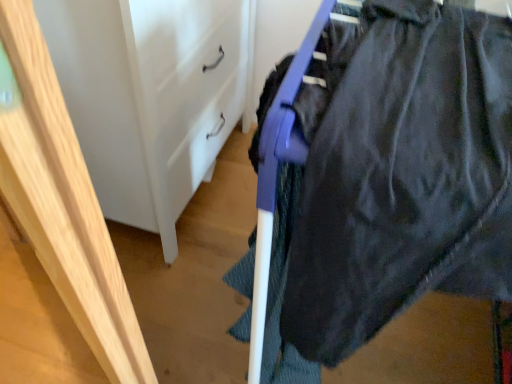
Measure the distance between point (79, 169) and camera.

Point (79, 169) is 11.50 inches from camera.

Locate an element on the screen. Image resolution: width=512 pixels, height=384 pixels. light wood frame at left is located at coordinates (63, 204).

Locate an element on the screen. The height and width of the screenshot is (384, 512). white matte/file cabinet at center is located at coordinates (149, 97).

Considering the relative sizes of white matte/file cabinet at center and dark matte fabric at upper right in the image provided, is white matte/file cabinet at center bigger than dark matte fabric at upper right?

No.

Would you say white matte/file cabinet at center is to the left or to the right of dark matte fabric at upper right in the picture?

white matte/file cabinet at center is positioned on dark matte fabric at upper right's left side.

Is white matte/file cabinet at center positioned with its back to dark matte fabric at upper right?

white matte/file cabinet at center is not turned away from dark matte fabric at upper right.

How different are the orientations of white matte/file cabinet at center and dark matte fabric at upper right in degrees?

They differ by 0.000244 degrees in their facing directions.

Looking at this image, can you confirm if white matte/file cabinet at center is taller than light wood frame at left?

No, white matte/file cabinet at center is not taller than light wood frame at left.

Is light wood frame at left a part of white matte/file cabinet at center?

Definitely not — light wood frame at left is not inside white matte/file cabinet at center.

Could you tell me if white matte/file cabinet at center is turned towards light wood frame at left?

No.

Is white matte/file cabinet at center wider than light wood frame at left?

Yes.

Considering their positions, is dark matte fabric at upper right located in front of or behind white matte/file cabinet at center?

dark matte fabric at upper right is positioned closer to the viewer than white matte/file cabinet at center.

Considering the relative sizes of dark matte fabric at upper right and white matte/file cabinet at center in the image provided, is dark matte fabric at upper right shorter than white matte/file cabinet at center?

Incorrect, the height of dark matte fabric at upper right does not fall short of that of white matte/file cabinet at center.

Visually, is dark matte fabric at upper right positioned to the left or to the right of white matte/file cabinet at center?

In the image, dark matte fabric at upper right appears on the right side of white matte/file cabinet at center.

Is dark matte fabric at upper right facing away from white matte/file cabinet at center?

Yes, dark matte fabric at upper right is facing away from white matte/file cabinet at center.

Can you tell me how much dark matte fabric at upper right and light wood frame at left differ in facing direction?

123 degrees separate the facing orientations of dark matte fabric at upper right and light wood frame at left.

From a real-world perspective, between dark matte fabric at upper right and light wood frame at left, who is vertically higher?

light wood frame at left.

Which of these two, dark matte fabric at upper right or light wood frame at left, is thinner?

light wood frame at left is thinner.

From the image's perspective, between dark matte fabric at upper right and light wood frame at left, which one is located above?

dark matte fabric at upper right is shown above in the image.

From the image's perspective, which is above, light wood frame at left or dark matte fabric at upper right?

dark matte fabric at upper right.

Is light wood frame at left taller or shorter than dark matte fabric at upper right?

light wood frame at left is taller than dark matte fabric at upper right.

Between light wood frame at left and dark matte fabric at upper right, which one has smaller size?

Smaller between the two is light wood frame at left.

Which is in front, light wood frame at left or white matte/file cabinet at center?

light wood frame at left is more forward.

Looking at this image, from the image's perspective, does light wood frame at left appear higher than white matte/file cabinet at center?

Incorrect, from the image's perspective, light wood frame at left is lower than white matte/file cabinet at center.

Which of these two, light wood frame at left or white matte/file cabinet at center, is wider?

Wider between the two is white matte/file cabinet at center.

Is light wood frame at left facing towards white matte/file cabinet at center?

No.

Where is `file cabinet on the left side of dark matte fabric at upper right`? file cabinet on the left side of dark matte fabric at upper right is located at coordinates (149, 97).

Find the location of a particular element. The height and width of the screenshot is (384, 512). file cabinet to the right of light wood frame at left is located at coordinates (x=149, y=97).

Based on their spatial positions, is white matte/file cabinet at center or light wood frame at left further from dark matte fabric at upper right?

Based on the image, white matte/file cabinet at center appears to be further to dark matte fabric at upper right.

From the image, which object appears to be farther from light wood frame at left, dark matte fabric at upper right or white matte/file cabinet at center?

Based on the image, white matte/file cabinet at center appears to be further to light wood frame at left.

Which object lies further to the anchor point light wood frame at left, white matte/file cabinet at center or dark matte fabric at upper right?

Based on the image, white matte/file cabinet at center appears to be further to light wood frame at left.

Considering their positions, is light wood frame at left positioned closer to white matte/file cabinet at center than dark matte fabric at upper right?

Based on the image, light wood frame at left appears to be nearer to white matte/file cabinet at center.

Considering their positions, is light wood frame at left positioned further to dark matte fabric at upper right than white matte/file cabinet at center?

white matte/file cabinet at center is positioned further to the anchor dark matte fabric at upper right.

From the image, which object appears to be farther from white matte/file cabinet at center, dark matte fabric at upper right or light wood frame at left?

dark matte fabric at upper right is further to white matte/file cabinet at center.

Identify the location of file cabinet situated between light wood frame at left and dark matte fabric at upper right from left to right. This screenshot has width=512, height=384. (149, 97).